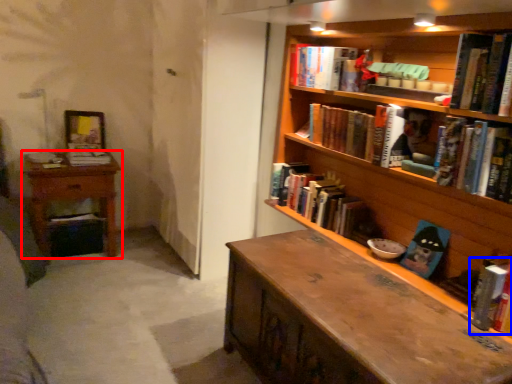
Question: Which point is closer to the camera, nightstand (highlighted by a red box) or book (highlighted by a blue box)?

Choices:
 (A) nightstand
 (B) book

Answer: (B)